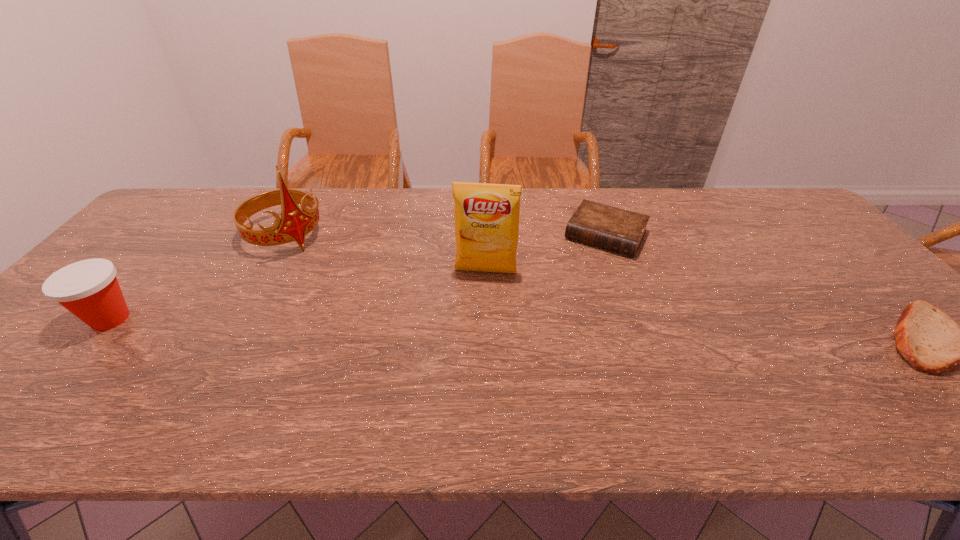
Identify the location of vacant position in the image that satisfies the following two spatial constraints: 1. on the back side of the second object from right to left; 2. on the right side of the third farthest object. (485, 235).

You are a GUI agent. You are given a task and a screenshot of the screen. Output one action in this format:
    pyautogui.click(x=<x>, y=<y>)
    Task: Click on the blank space that satisfies the following two spatial constraints: 1. on the back side of the tiara; 2. on the left side of the leftmost object
    
    Given the screenshot: What is the action you would take?
    pyautogui.click(x=181, y=237)

Where is `free spot that satisfies the following two spatial constraints: 1. on the back side of the fourth object from left to right; 2. on the right side of the Dixie cup`? This screenshot has height=540, width=960. free spot that satisfies the following two spatial constraints: 1. on the back side of the fourth object from left to right; 2. on the right side of the Dixie cup is located at coordinates [x=183, y=235].